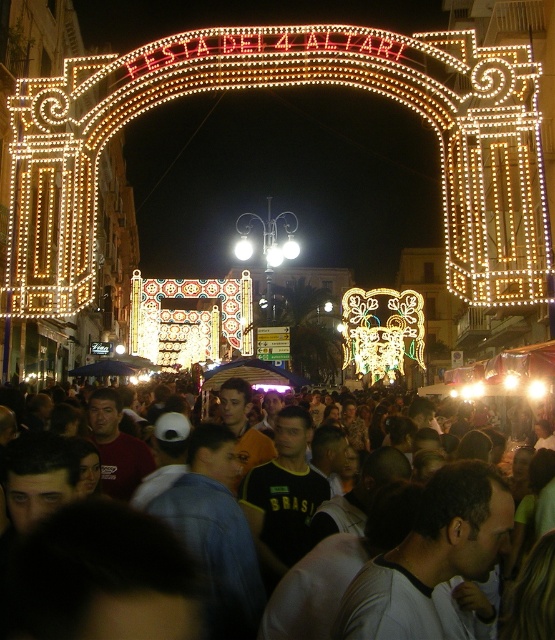
Who is positioned more to the left, illuminated neon sign at upper center or dark gray clothing at center?

From the viewer's perspective, dark gray clothing at center appears more on the left side.

Between illuminated neon sign at upper center and dark gray clothing at center, which one appears on the right side from the viewer's perspective?

Positioned to the right is illuminated neon sign at upper center.

Does point (98, 97) come closer to viewer compared to point (468, 465)?

No, (98, 97) is further to viewer.

Locate an element on the screen. illuminated neon sign at upper center is located at coordinates (280, 84).